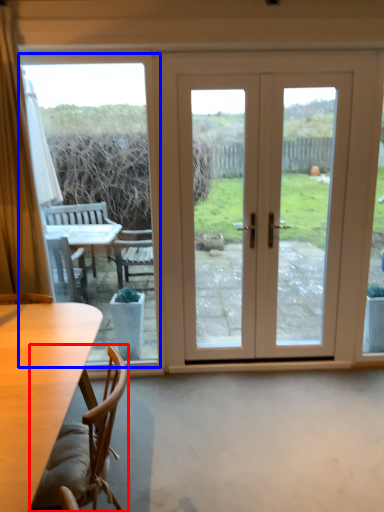
Question: Which object appears farthest to the camera in this image, chair (highlighted by a red box) or window screen (highlighted by a blue box)?

Choices:
 (A) chair
 (B) window screen

Answer: (B)